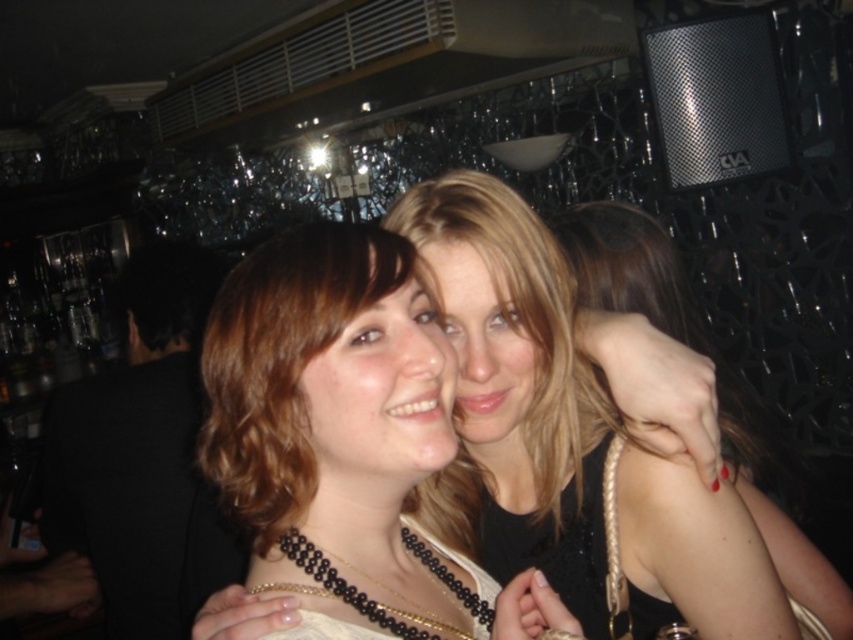
You are a photographer at the event and want to take a photo of the smooth blonde hair at center and the black beaded necklace at center. Which object is closer to the camera?

The smooth blonde hair at center is closer to the camera than the black beaded necklace at center.

Where is the smooth blonde hair at center located in the image?

The smooth blonde hair at center is located at point (573, 438).

You are a photographer at a social event and want to capture a photo of both people with their hair clearly visible. Since the two people are standing close, you need to adjust your camera angle to ensure both smooth blonde hair at center and smooth brown hair at center are fully visible. Based on their positions, which direction should you aim the camera to capture both?

The smooth blonde hair at center is positioned on the right side of smooth brown hair at center, so aiming the camera to the left will ensure both are fully visible.